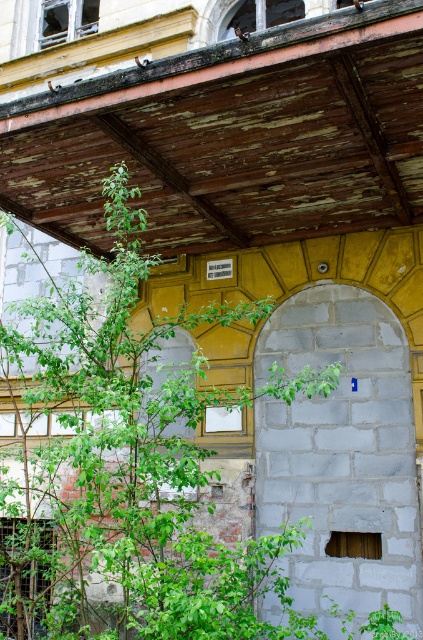
Question: Is green leafy tree at center bigger than gray stone pillar at center?

Choices:
 (A) yes
 (B) no

Answer: (A)

Question: Does green leafy tree at center appear under gray stone pillar at center?

Choices:
 (A) no
 (B) yes

Answer: (B)

Question: Which point is closer to the camera taking this photo?

Choices:
 (A) (288, 625)
 (B) (280, 476)

Answer: (A)

Question: Does green leafy tree at center have a lesser width compared to gray stone pillar at center?

Choices:
 (A) no
 (B) yes

Answer: (A)